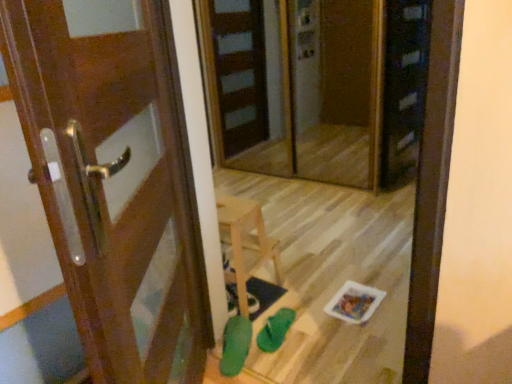
Question: Does green rubber shoe at lower center, which is the 1th shoe from right to left, lie in front of green rubber shoe at lower center, which is the second shoe in right-to-left order?

Choices:
 (A) yes
 (B) no

Answer: (B)

Question: Is green rubber shoe at lower center, the 2th shoe in the left-to-right sequence, thinner than green rubber shoe at lower center, arranged as the first shoe when viewed from the left?

Choices:
 (A) yes
 (B) no

Answer: (A)

Question: Is green rubber shoe at lower center, which is the 1th shoe from right to left, facing towards green rubber shoe at lower center, which is the second shoe in right-to-left order?

Choices:
 (A) yes
 (B) no

Answer: (B)

Question: Is green rubber shoe at lower center, the 2th shoe in the left-to-right sequence, located outside green rubber shoe at lower center, arranged as the first shoe when viewed from the left?

Choices:
 (A) yes
 (B) no

Answer: (A)

Question: From the image's perspective, would you say green rubber shoe at lower center, the 2th shoe in the left-to-right sequence, is positioned over green rubber shoe at lower center, arranged as the first shoe when viewed from the left?

Choices:
 (A) no
 (B) yes

Answer: (B)

Question: Does green rubber shoe at lower center, the 2th shoe in the left-to-right sequence, have a lesser height compared to green rubber shoe at lower center, which is the second shoe in right-to-left order?

Choices:
 (A) no
 (B) yes

Answer: (B)

Question: Can you confirm if transparent glass screen door at center is positioned to the left of wooden door at left?

Choices:
 (A) yes
 (B) no

Answer: (B)

Question: Does transparent glass screen door at center have a lesser height compared to wooden door at left?

Choices:
 (A) yes
 (B) no

Answer: (B)

Question: Is transparent glass screen door at center positioned before wooden door at left?

Choices:
 (A) yes
 (B) no

Answer: (B)

Question: Can you confirm if transparent glass screen door at center is smaller than wooden door at left?

Choices:
 (A) yes
 (B) no

Answer: (B)

Question: Would you say transparent glass screen door at center is a long distance from wooden door at left?

Choices:
 (A) no
 (B) yes

Answer: (B)

Question: Considering the relative sizes of transparent glass screen door at center and wooden door at left in the image provided, is transparent glass screen door at center thinner than wooden door at left?

Choices:
 (A) yes
 (B) no

Answer: (A)

Question: Is green rubber shoe at lower center, arranged as the first shoe when viewed from the left, surrounded by transparent glass screen door at center?

Choices:
 (A) no
 (B) yes

Answer: (A)